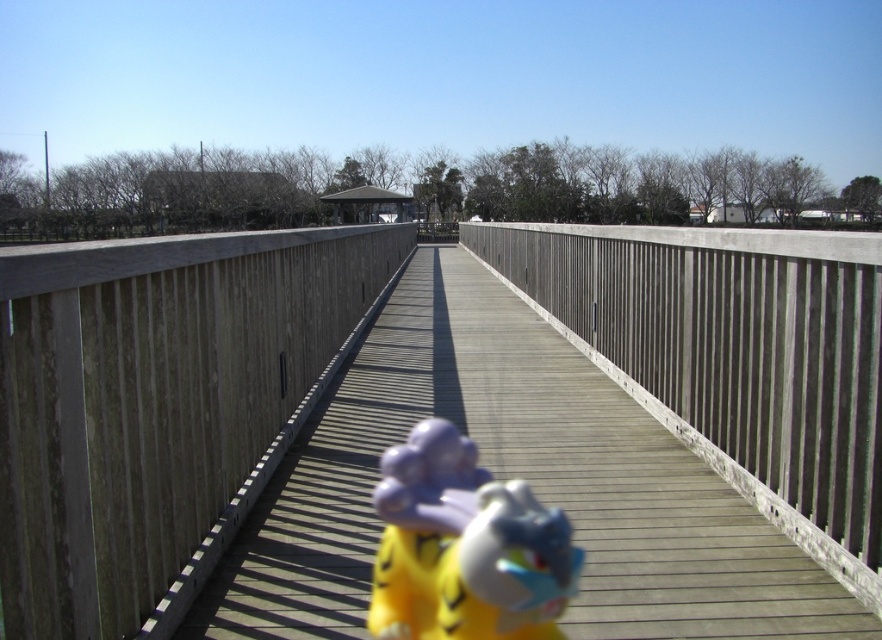
You are standing on the wooden bridge at center and want to pick up the yellow plush toy at center. Which direction should you move to reach it?

The wooden bridge at center is to the left of yellow plush toy at center, so you should move to your right to reach the yellow plush toy at center.

You are standing at the starting point of the wooden walkway and see the point marked at (152, 401). Which direction should you walk to reach the wooden bridge at center located at that point?

The wooden bridge at center is located at point (152, 401), so you should walk forward along the walkway towards the center to reach it.